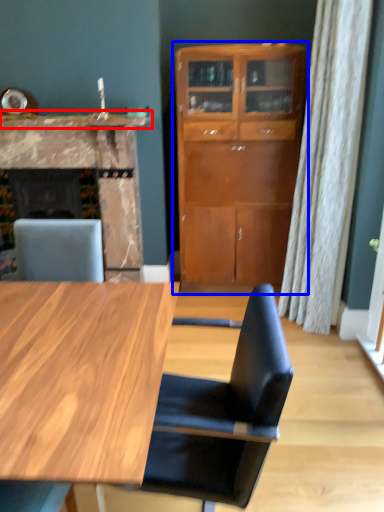
Question: Which of the following is the closest to the observer, counter top (highlighted by a red box) or cabinetry (highlighted by a blue box)?

Choices:
 (A) counter top
 (B) cabinetry

Answer: (B)